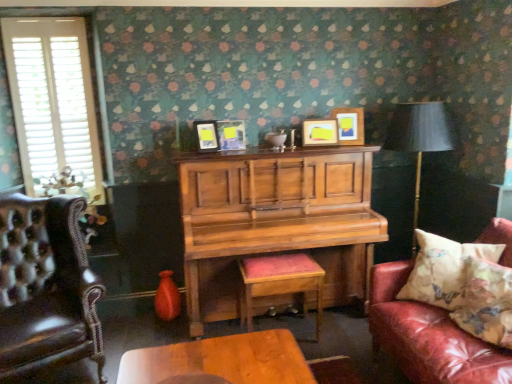
Question: Considering the relative sizes of matte black picture frame at center, the first picture frame positioned from the left, and leather tufted armchair at left in the image provided, is matte black picture frame at center, the first picture frame positioned from the left, wider than leather tufted armchair at left?

Choices:
 (A) yes
 (B) no

Answer: (B)

Question: Would you consider matte black picture frame at center, the fourth picture frame in the right-to-left sequence, to be distant from leather tufted armchair at left?

Choices:
 (A) yes
 (B) no

Answer: (A)

Question: Is matte black picture frame at center, the fourth picture frame in the right-to-left sequence, at the left side of leather tufted armchair at left?

Choices:
 (A) yes
 (B) no

Answer: (B)

Question: Is matte black picture frame at center, the first picture frame positioned from the left, in front of leather tufted armchair at left?

Choices:
 (A) yes
 (B) no

Answer: (B)

Question: From a real-world perspective, is matte black picture frame at center, the fourth picture frame in the right-to-left sequence, on top of leather tufted armchair at left?

Choices:
 (A) yes
 (B) no

Answer: (A)

Question: Considering the relative positions of matte black picture frame at center, the fourth picture frame in the right-to-left sequence, and matte black lampshade at right in the image provided, is matte black picture frame at center, the fourth picture frame in the right-to-left sequence, to the left or to the right of matte black lampshade at right?

Choices:
 (A) left
 (B) right

Answer: (A)

Question: From the image's perspective, is matte black picture frame at center, the fourth picture frame in the right-to-left sequence, located above or below matte black lampshade at right?

Choices:
 (A) above
 (B) below

Answer: (A)

Question: Based on their sizes in the image, would you say matte black picture frame at center, the fourth picture frame in the right-to-left sequence, is bigger or smaller than matte black lampshade at right?

Choices:
 (A) small
 (B) big

Answer: (A)

Question: Is matte black picture frame at center, the fourth picture frame in the right-to-left sequence, spatially inside matte black lampshade at right, or outside of it?

Choices:
 (A) inside
 (B) outside

Answer: (B)

Question: Is floral fabric cushion at right, the 2th pillow positioned from the front, inside or outside of floral fabric cushion at right, positioned as the second pillow in back-to-front order?

Choices:
 (A) inside
 (B) outside

Answer: (B)

Question: Is floral fabric cushion at right, the 1th pillow when ordered from back to front, taller or shorter than floral fabric cushion at right, which is counted as the first pillow, starting from the front?

Choices:
 (A) short
 (B) tall

Answer: (B)

Question: Is floral fabric cushion at right, the 1th pillow when ordered from back to front, wider or thinner than floral fabric cushion at right, which is counted as the first pillow, starting from the front?

Choices:
 (A) wide
 (B) thin

Answer: (B)

Question: Is floral fabric cushion at right, the 2th pillow positioned from the front, in front of or behind floral fabric cushion at right, which is counted as the first pillow, starting from the front, in the image?

Choices:
 (A) behind
 (B) front

Answer: (A)

Question: From the image's perspective, relative to matte yellow picture frame at upper right, the 1th picture frame in the right-to-left sequence, is leather couch with floral pillow at right above or below?

Choices:
 (A) above
 (B) below

Answer: (B)

Question: From a real-world perspective, is leather couch with floral pillow at right positioned above or below matte yellow picture frame at upper right, the 4th picture frame viewed from the left?

Choices:
 (A) below
 (B) above

Answer: (A)